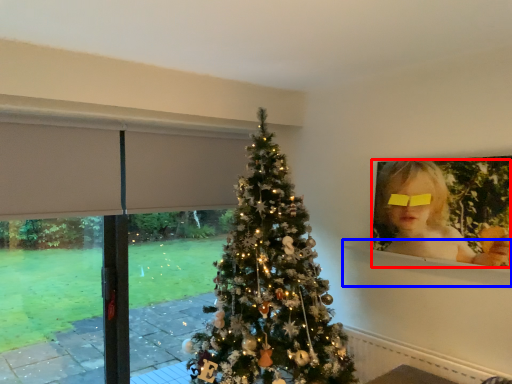
Question: Which of the following is the closest to the observer, person (highlighted by a red box) or window sill (highlighted by a blue box)?

Choices:
 (A) person
 (B) window sill

Answer: (A)